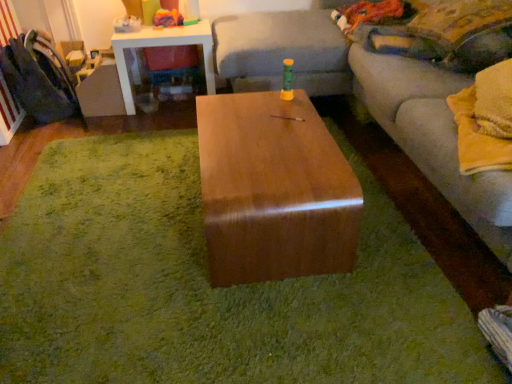
Question: Is velvet yellow pillow at upper right further to the viewer compared to velvet dark blue swivel chair at left?

Choices:
 (A) no
 (B) yes

Answer: (A)

Question: Can you confirm if velvet yellow pillow at upper right is shorter than velvet dark blue swivel chair at left?

Choices:
 (A) yes
 (B) no

Answer: (A)

Question: From the image's perspective, would you say velvet yellow pillow at upper right is positioned over velvet dark blue swivel chair at left?

Choices:
 (A) yes
 (B) no

Answer: (A)

Question: Would you say velvet yellow pillow at upper right is a long distance from velvet dark blue swivel chair at left?

Choices:
 (A) no
 (B) yes

Answer: (B)

Question: Considering the relative sizes of velvet yellow pillow at upper right and velvet dark blue swivel chair at left in the image provided, is velvet yellow pillow at upper right wider than velvet dark blue swivel chair at left?

Choices:
 (A) no
 (B) yes

Answer: (B)

Question: From a real-world perspective, is velvet yellow pillow at upper right physically below velvet dark blue swivel chair at left?

Choices:
 (A) yes
 (B) no

Answer: (B)

Question: Is rubberized plastic toy at upper left next to brown glossy wood table at center?

Choices:
 (A) yes
 (B) no

Answer: (B)

Question: Considering the relative sizes of rubberized plastic toy at upper left and brown glossy wood table at center in the image provided, is rubberized plastic toy at upper left bigger than brown glossy wood table at center?

Choices:
 (A) no
 (B) yes

Answer: (A)

Question: Does rubberized plastic toy at upper left come behind brown glossy wood table at center?

Choices:
 (A) yes
 (B) no

Answer: (A)

Question: From a real-world perspective, is rubberized plastic toy at upper left located beneath brown glossy wood table at center?

Choices:
 (A) no
 (B) yes

Answer: (A)

Question: Is rubberized plastic toy at upper left to the left of brown glossy wood table at center from the viewer's perspective?

Choices:
 (A) no
 (B) yes

Answer: (B)

Question: Is rubberized plastic toy at upper left shorter than brown glossy wood table at center?

Choices:
 (A) no
 (B) yes

Answer: (A)

Question: Is shiny brown wood coffee table at center facing away from white glossy side table at upper left?

Choices:
 (A) yes
 (B) no

Answer: (B)